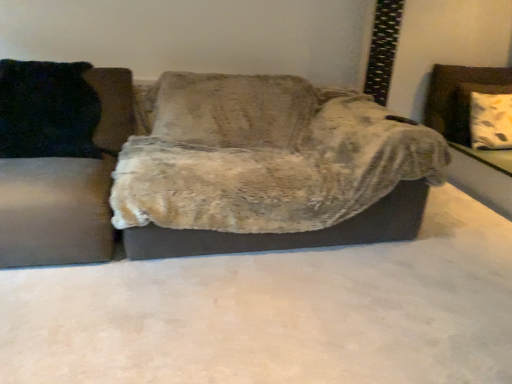
Where is `white textured cushion at right`? Image resolution: width=512 pixels, height=384 pixels. white textured cushion at right is located at coordinates (469, 131).

Find the location of a particular element. The width and height of the screenshot is (512, 384). black fuzzy pillow at left is located at coordinates (47, 110).

At what (x,y) coordinates should I click in order to perform the action: click on white textured cushion at right. Please return your answer as a coordinate pair (x, y). This screenshot has width=512, height=384. Looking at the image, I should click on (469, 131).

From a real-world perspective, relative to white textured cushion at right, is fuzzy fabric couch at center, the 2th studio couch from the left, vertically above or below?

fuzzy fabric couch at center, the 2th studio couch from the left, is situated lower than white textured cushion at right in the real world.

Which of these two, fuzzy fabric couch at center, the 1th studio couch in the right-to-left sequence, or white textured cushion at right, is wider?

fuzzy fabric couch at center, the 1th studio couch in the right-to-left sequence.

Which of these two, fuzzy fabric couch at center, the 1th studio couch in the right-to-left sequence, or white textured cushion at right, stands shorter?

white textured cushion at right is shorter.

Which object is positioned more to the left, velvet black pillow at left, which is the first studio couch from left to right, or fuzzy fabric couch at center, the 2th studio couch from the left?

Positioned to the left is velvet black pillow at left, which is the first studio couch from left to right.

In terms of size, does velvet black pillow at left, which is the second studio couch from right to left, appear bigger or smaller than fuzzy fabric couch at center, the 2th studio couch from the left?

velvet black pillow at left, which is the second studio couch from right to left, is smaller than fuzzy fabric couch at center, the 2th studio couch from the left.

Where is `studio couch directly beneath the velvet black pillow at left, which is the second studio couch from right to left (from a real-world perspective)`? This screenshot has height=384, width=512. studio couch directly beneath the velvet black pillow at left, which is the second studio couch from right to left (from a real-world perspective) is located at coordinates (222, 173).

How many degrees apart are the facing directions of velvet black pillow at left, which is the second studio couch from right to left, and fuzzy fabric couch at center, the 2th studio couch from the left?

There is a 1.3-degree angle between the facing directions of velvet black pillow at left, which is the second studio couch from right to left, and fuzzy fabric couch at center, the 2th studio couch from the left.

Can you tell me how much fuzzy fabric couch at center, the 1th studio couch in the right-to-left sequence, and velvet black pillow at left, which is the first studio couch from left to right, differ in facing direction?

There is a 1.3-degree angle between the facing directions of fuzzy fabric couch at center, the 1th studio couch in the right-to-left sequence, and velvet black pillow at left, which is the first studio couch from left to right.

Is there a large distance between fuzzy fabric couch at center, the 2th studio couch from the left, and velvet black pillow at left, which is the second studio couch from right to left?

No, fuzzy fabric couch at center, the 2th studio couch from the left, is not far away from velvet black pillow at left, which is the second studio couch from right to left.

Does point (198, 133) lie in front of point (65, 232)?

No.

Is fuzzy fabric couch at center, the 1th studio couch in the right-to-left sequence, at the right side of velvet black pillow at left, which is the first studio couch from left to right?

Yes, fuzzy fabric couch at center, the 1th studio couch in the right-to-left sequence, is to the right of velvet black pillow at left, which is the first studio couch from left to right.

From a real-world perspective, is black fuzzy pillow at left over velvet black pillow at left, which is the second studio couch from right to left?

Yes, from a real-world perspective, black fuzzy pillow at left is over velvet black pillow at left, which is the second studio couch from right to left

Can you confirm if black fuzzy pillow at left is wider than velvet black pillow at left, which is the first studio couch from left to right?

No.

Between black fuzzy pillow at left and velvet black pillow at left, which is the second studio couch from right to left, which one has smaller size?

With smaller size is black fuzzy pillow at left.

Is there a large distance between black fuzzy pillow at left and velvet black pillow at left, which is the first studio couch from left to right?

They are positioned close to each other.

Between fuzzy fabric couch at center, the 1th studio couch in the right-to-left sequence, and black fuzzy pillow at left, which one has smaller width?

With smaller width is black fuzzy pillow at left.

Does fuzzy fabric couch at center, the 1th studio couch in the right-to-left sequence, lie behind black fuzzy pillow at left?

No, it is in front of black fuzzy pillow at left.

Between fuzzy fabric couch at center, the 2th studio couch from the left, and black fuzzy pillow at left, which one appears on the left side from the viewer's perspective?

From the viewer's perspective, black fuzzy pillow at left appears more on the left side.

From the picture: From the image's perspective, is fuzzy fabric couch at center, the 2th studio couch from the left, located beneath black fuzzy pillow at left?

Yes, from the image's perspective, fuzzy fabric couch at center, the 2th studio couch from the left, is beneath black fuzzy pillow at left.

Find the location of a particular element. This screenshot has width=512, height=384. pillow above the fuzzy fabric couch at center, the 2th studio couch from the left (from the image's perspective) is located at coordinates (47, 110).

Is black fuzzy pillow at left placed right next to fuzzy fabric couch at center, the 1th studio couch in the right-to-left sequence?

No, black fuzzy pillow at left is not beside fuzzy fabric couch at center, the 1th studio couch in the right-to-left sequence.

Does black fuzzy pillow at left have a smaller size compared to fuzzy fabric couch at center, the 1th studio couch in the right-to-left sequence?

Yes.

Would you say black fuzzy pillow at left is to the left or to the right of fuzzy fabric couch at center, the 2th studio couch from the left, in the picture?

black fuzzy pillow at left is positioned on fuzzy fabric couch at center, the 2th studio couch from the left,'s left side.

Who is smaller, white textured cushion at right or black fuzzy pillow at left?

Smaller between the two is white textured cushion at right.

Can you tell me how much white textured cushion at right and black fuzzy pillow at left differ in facing direction?

white textured cushion at right and black fuzzy pillow at left are facing 4.59 degrees away from each other.

Locate an element on the screen. pillow that appears below the white textured cushion at right (from the image's perspective) is located at coordinates (47, 110).

Is white textured cushion at right next to black fuzzy pillow at left?

No, white textured cushion at right is not next to black fuzzy pillow at left.

From a real-world perspective, starting from the white textured cushion at right, which studio couch is the 2nd one below it? Please provide its 2D coordinates.

[(222, 173)]

The image size is (512, 384). I want to click on studio couch located behind the velvet black pillow at left, which is the second studio couch from right to left, so click(x=222, y=173).

Considering their positions, is white textured cushion at right positioned further to velvet black pillow at left, which is the first studio couch from left to right, than black fuzzy pillow at left?

The object further to velvet black pillow at left, which is the first studio couch from left to right, is white textured cushion at right.

Which object lies further to the anchor point white textured cushion at right, velvet black pillow at left, which is the second studio couch from right to left, or black fuzzy pillow at left?

black fuzzy pillow at left is positioned further to the anchor white textured cushion at right.

Which object lies nearer to the anchor point white textured cushion at right, black fuzzy pillow at left or velvet black pillow at left, which is the second studio couch from right to left?

Among the two, velvet black pillow at left, which is the second studio couch from right to left, is located nearer to white textured cushion at right.

Which object lies nearer to the anchor point velvet black pillow at left, which is the second studio couch from right to left, white textured cushion at right or fuzzy fabric couch at center, the 2th studio couch from the left?

fuzzy fabric couch at center, the 2th studio couch from the left, is closer to velvet black pillow at left, which is the second studio couch from right to left.

Estimate the real-world distances between objects in this image. Which object is further from black fuzzy pillow at left, fuzzy fabric couch at center, the 2th studio couch from the left, or velvet black pillow at left, which is the second studio couch from right to left?

fuzzy fabric couch at center, the 2th studio couch from the left, is further to black fuzzy pillow at left.

Based on their spatial positions, is white textured cushion at right or black fuzzy pillow at left further from fuzzy fabric couch at center, the 1th studio couch in the right-to-left sequence?

Among the two, white textured cushion at right is located further to fuzzy fabric couch at center, the 1th studio couch in the right-to-left sequence.

Considering their positions, is velvet black pillow at left, which is the second studio couch from right to left, positioned closer to fuzzy fabric couch at center, the 1th studio couch in the right-to-left sequence, than black fuzzy pillow at left?

Based on the image, velvet black pillow at left, which is the second studio couch from right to left, appears to be nearer to fuzzy fabric couch at center, the 1th studio couch in the right-to-left sequence.

Looking at the image, which one is located further to fuzzy fabric couch at center, the 1th studio couch in the right-to-left sequence, velvet black pillow at left, which is the first studio couch from left to right, or white textured cushion at right?

white textured cushion at right lies further to fuzzy fabric couch at center, the 1th studio couch in the right-to-left sequence, than the other object.

Find the location of a particular element. studio couch between black fuzzy pillow at left and fuzzy fabric couch at center, the 2th studio couch from the left is located at coordinates (54, 212).

Identify the location of studio couch between velvet black pillow at left, which is the first studio couch from left to right, and white textured cushion at right. (222, 173).